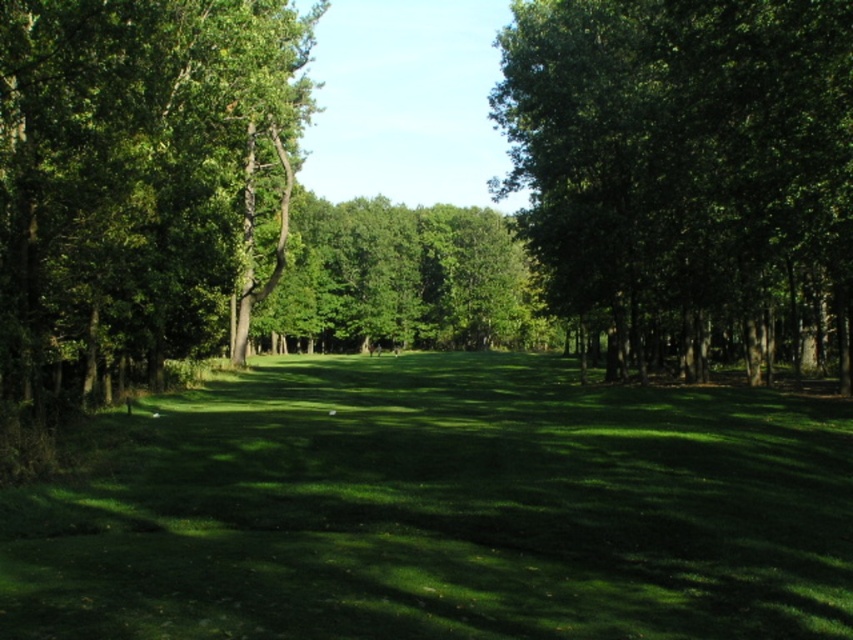
Question: Considering the relative positions of green leafy tree at right and green leafy tree at center in the image provided, where is green leafy tree at right located with respect to green leafy tree at center?

Choices:
 (A) left
 (B) right

Answer: (B)

Question: Is green leafy tree at left to the right of green leafy tree at center from the viewer's perspective?

Choices:
 (A) yes
 (B) no

Answer: (B)

Question: Which point is farther to the camera?

Choices:
 (A) green leafy tree at center
 (B) green leafy tree at right
 (C) green grass at center
 (D) green leafy tree at left

Answer: (A)

Question: Which of the following is the closest to the observer?

Choices:
 (A) (171, 244)
 (B) (786, 627)
 (C) (778, 292)
 (D) (374, 244)

Answer: (B)

Question: Does green grass at center have a lesser width compared to green leafy tree at right?

Choices:
 (A) yes
 (B) no

Answer: (B)

Question: Among these points, which one is nearest to the camera?

Choices:
 (A) (428, 513)
 (B) (576, 88)
 (C) (529, 333)

Answer: (A)